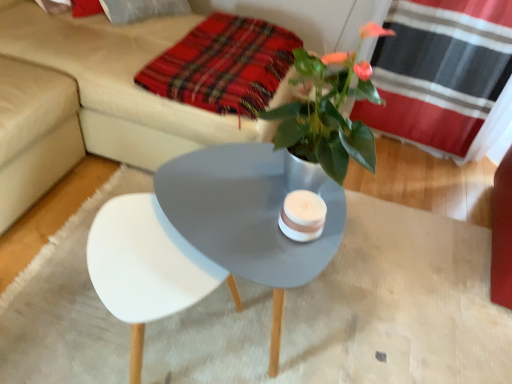
Question: Is beige fabric couch at upper center turned away from metallic silver plant at center?

Choices:
 (A) yes
 (B) no

Answer: (B)

Question: Is beige fabric couch at upper center oriented towards metallic silver plant at center?

Choices:
 (A) no
 (B) yes

Answer: (A)

Question: From the image's perspective, does beige fabric couch at upper center appear higher than metallic silver plant at center?

Choices:
 (A) no
 (B) yes

Answer: (B)

Question: From the image's perspective, is beige fabric couch at upper center below metallic silver plant at center?

Choices:
 (A) no
 (B) yes

Answer: (A)

Question: Is beige fabric couch at upper center far away from metallic silver plant at center?

Choices:
 (A) yes
 (B) no

Answer: (B)

Question: Can you confirm if beige fabric couch at upper center is thinner than metallic silver plant at center?

Choices:
 (A) yes
 (B) no

Answer: (B)

Question: Would you say metallic silver plant at center is a long distance from plaid fabric at upper center?

Choices:
 (A) yes
 (B) no

Answer: (B)

Question: From the image's perspective, is metallic silver plant at center under plaid fabric at upper center?

Choices:
 (A) no
 (B) yes

Answer: (B)

Question: Can you confirm if metallic silver plant at center is shorter than plaid fabric at upper center?

Choices:
 (A) no
 (B) yes

Answer: (A)

Question: Is plaid fabric at upper center a part of metallic silver plant at center?

Choices:
 (A) yes
 (B) no

Answer: (B)

Question: Is metallic silver plant at center taller than plaid fabric at upper center?

Choices:
 (A) yes
 (B) no

Answer: (A)

Question: Can you confirm if metallic silver plant at center is smaller than plaid fabric at upper center?

Choices:
 (A) yes
 (B) no

Answer: (B)

Question: Considering the relative sizes of plaid fabric at upper center and beige fabric couch at upper center in the image provided, is plaid fabric at upper center smaller than beige fabric couch at upper center?

Choices:
 (A) no
 (B) yes

Answer: (B)